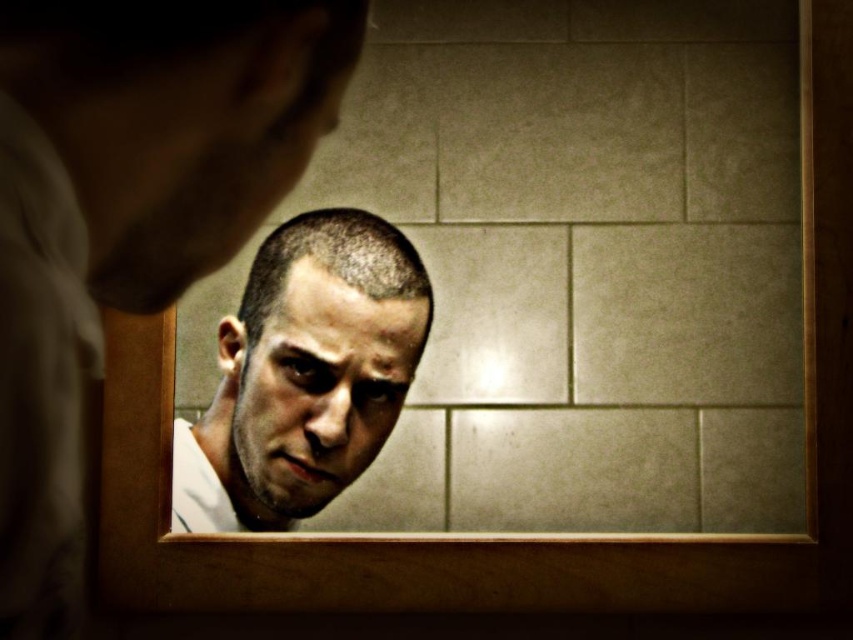
What do you see at coordinates (314, 390) in the screenshot?
I see `smooth skin face at center` at bounding box center [314, 390].

From the picture: Is smooth skin face at center bigger than shiny skin face at center?

Yes, smooth skin face at center is bigger than shiny skin face at center.

I want to click on smooth skin face at center, so click(314, 390).

Is smooth white shirt at upper left shorter than shiny skin face at center?

Incorrect, smooth white shirt at upper left's height does not fall short of shiny skin face at center's.

Which is more to the right, smooth white shirt at upper left or shiny skin face at center?

From the viewer's perspective, shiny skin face at center appears more on the right side.

Which is in front, point (149, 26) or point (248, 106)?

Point (149, 26) is in front.

You are a GUI agent. You are given a task and a screenshot of the screen. Output one action in this format:
    pyautogui.click(x=<x>, y=<y>)
    Task: Click on the smooth white shirt at upper left
    The width and height of the screenshot is (853, 640).
    Given the screenshot: What is the action you would take?
    pyautogui.click(x=128, y=216)

Is point (225, 0) positioned after point (322, 371)?

That is False.

Does smooth white shirt at upper left appear under smooth skin face at center?

No.

Locate an element on the screen. smooth white shirt at upper left is located at coordinates (128, 216).